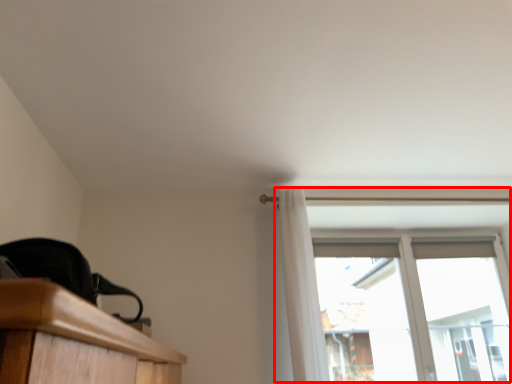
Question: From the image's perspective, where is window (annotated by the red box) located relative to curtain?

Choices:
 (A) above
 (B) below

Answer: (B)